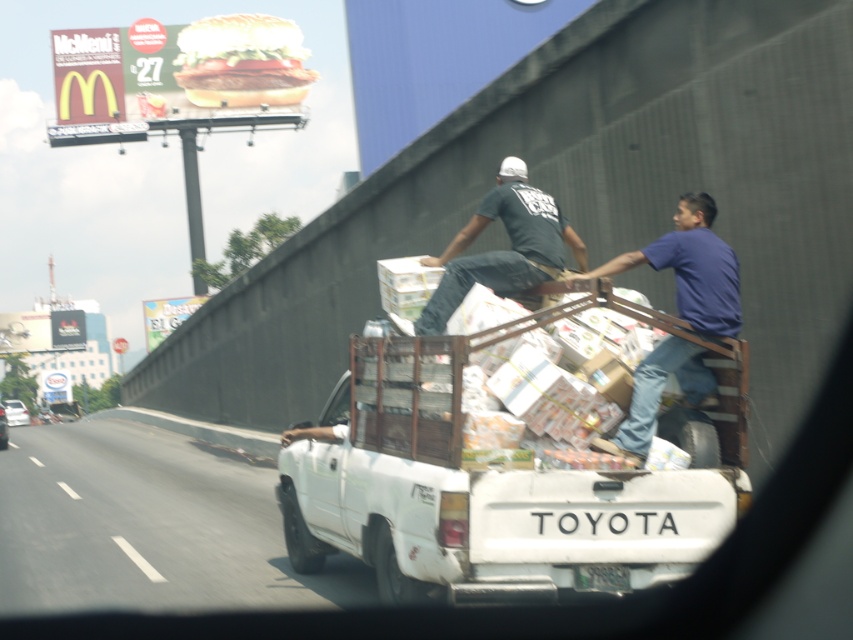
Question: Among these points, which one is nearest to the camera?

Choices:
 (A) (698, 264)
 (B) (231, 557)
 (C) (701, 550)

Answer: (C)

Question: Which point is farther to the camera?

Choices:
 (A) black cotton shirt at upper center
 (B) white plastic truck at lower left
 (C) blue cotton shirt at upper right
 (D) white matte truck at center

Answer: (B)

Question: From the image, what is the correct spatial relationship of white plastic truck at lower left in relation to black cotton shirt at upper center?

Choices:
 (A) left
 (B) right

Answer: (A)

Question: Where is white plastic truck at lower left located in relation to blue cotton shirt at upper right in the image?

Choices:
 (A) above
 (B) below

Answer: (B)

Question: Can you confirm if white matte truck at center is bigger than black cotton shirt at upper center?

Choices:
 (A) yes
 (B) no

Answer: (A)

Question: Which of the following is the closest to the observer?

Choices:
 (A) (544, 250)
 (B) (653, 378)
 (C) (482, 589)

Answer: (C)